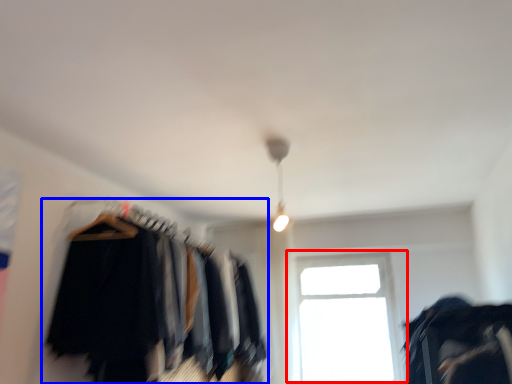
Question: Which point is further to the camera, window (highlighted by a red box) or closet (highlighted by a blue box)?

Choices:
 (A) window
 (B) closet

Answer: (A)